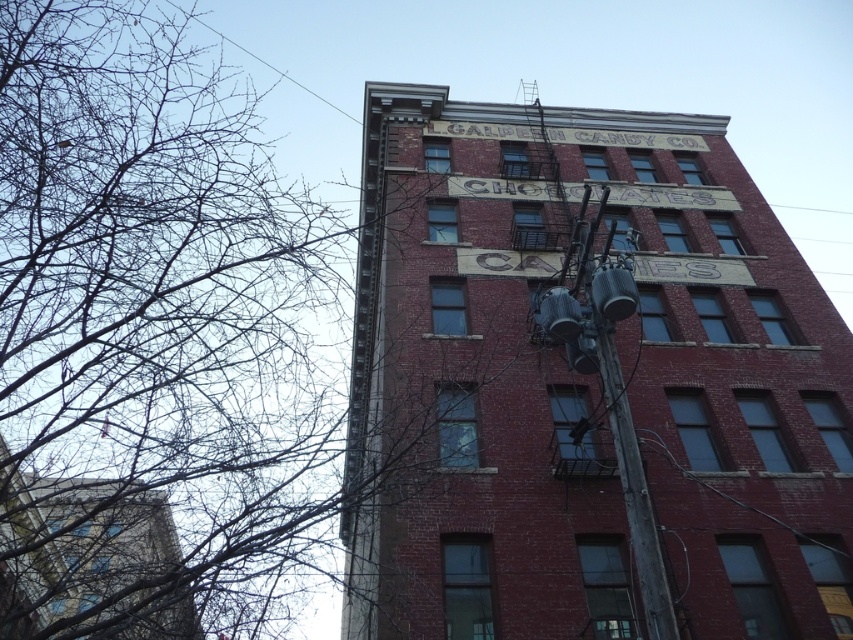
You are standing in front of the red brick building at upper center and looking towards the bare branches at upper left. Which object is closer to the top of the image?

The bare branches at upper left are closer to the top of the image because the red brick building at upper center is shorter than them.

You are standing in a park and looking at the red brick building at upper center and the bare branches at upper left. Which object is higher up in the image?

The bare branches at upper left are higher up in the image because the red brick building at upper center is located below them.

You are an urban planner analyzing the image of a historic district. You notice the red brick building at upper center and the bare branches at upper left. Which object occupies a larger area in the image?

The bare branches at upper left occupy a larger area in the image since the red brick building at upper center has a smaller size compared to them.